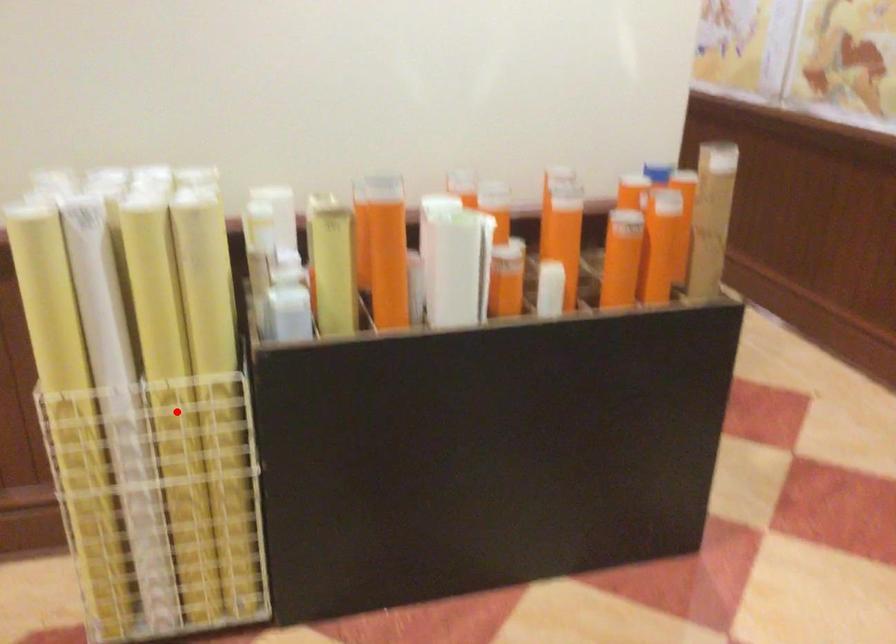
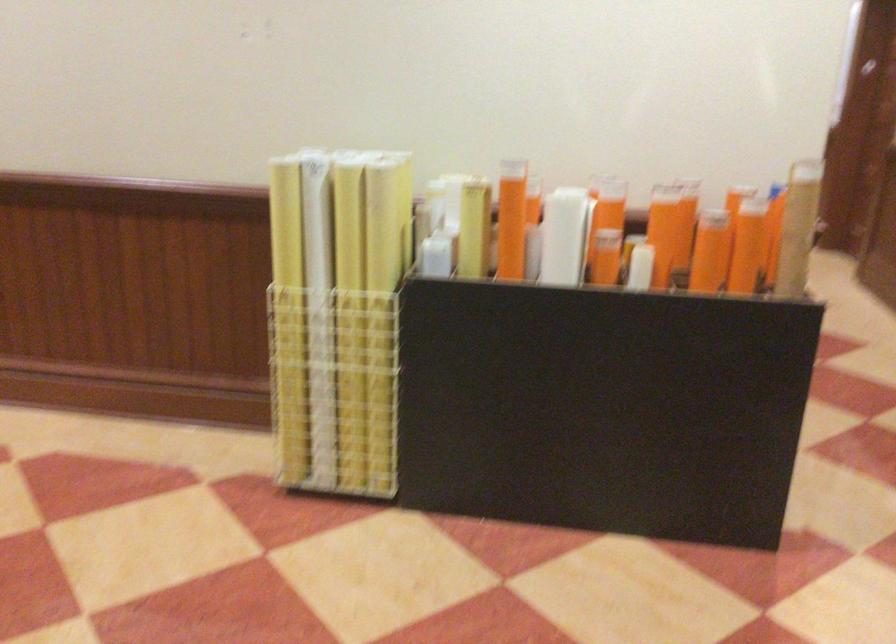
Locate, in the second image, the point that corresponds to the highlighted location in the first image.

(350, 315)